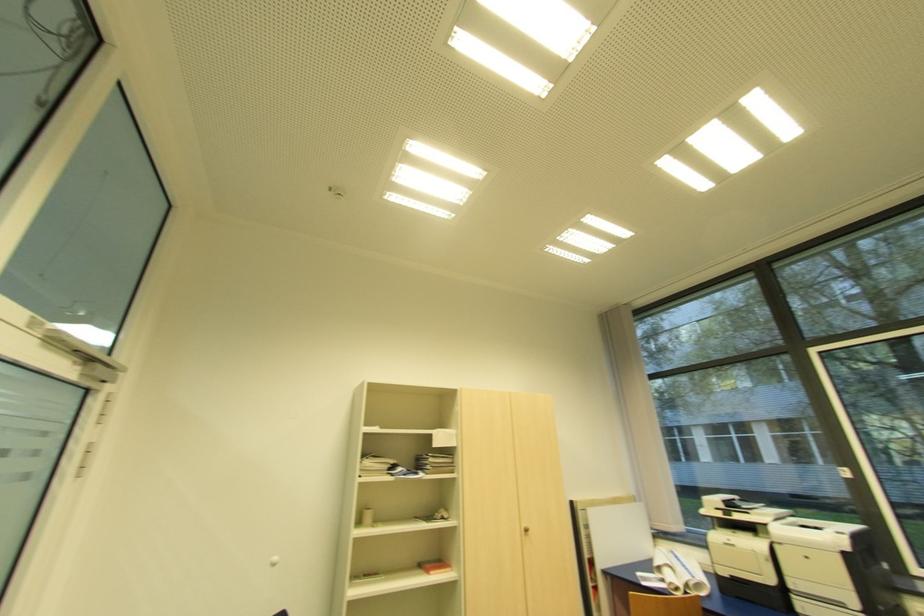
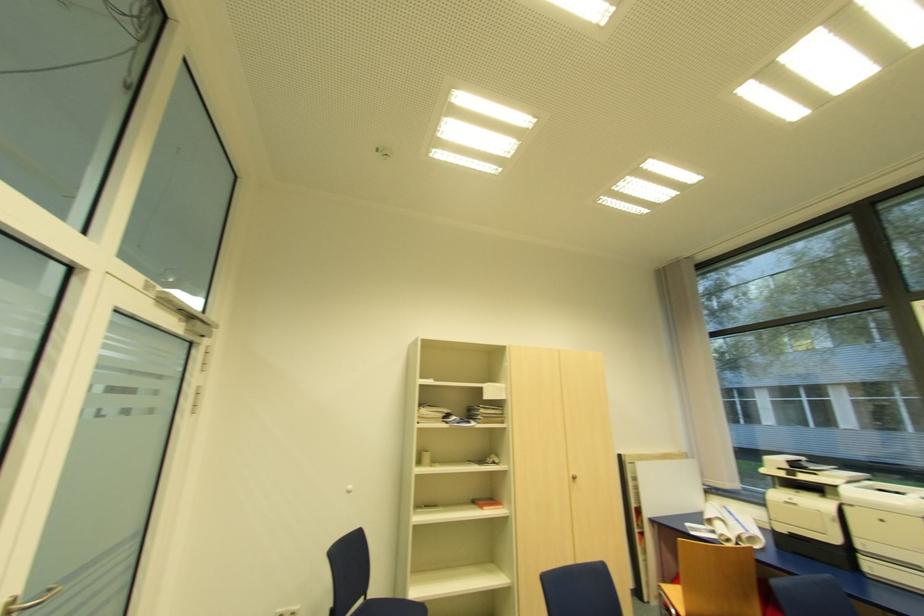
What movement of the cameraman would produce the second image?

The movement direction of the cameraman is left, backward.